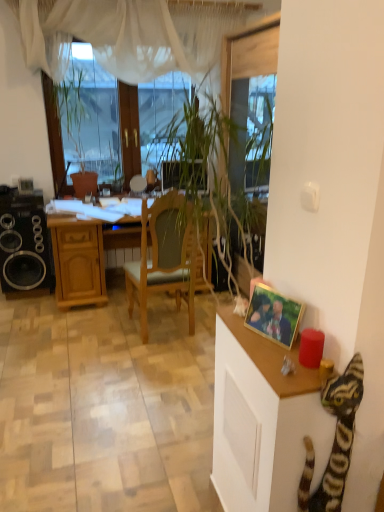
You are a GUI agent. You are given a task and a screenshot of the screen. Output one action in this format:
    pyautogui.click(x=<x>, y=<y>)
    Task: Click on the free space above wooden cabinet at right (from a real-world perspective)
    
    Given the screenshot: What is the action you would take?
    pyautogui.click(x=264, y=342)